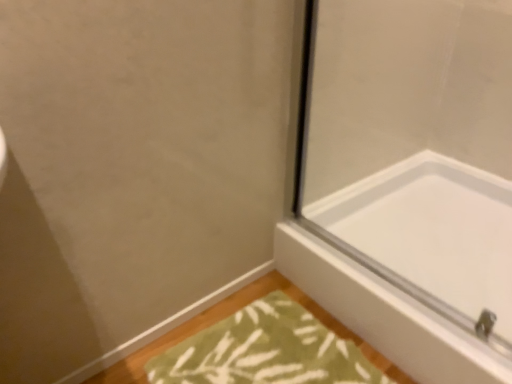
Question: Can you confirm if green textured bath mat at lower center is wider than white glossy bathtub at lower right?

Choices:
 (A) yes
 (B) no

Answer: (B)

Question: Is green textured bath mat at lower center further to camera compared to white glossy bathtub at lower right?

Choices:
 (A) no
 (B) yes

Answer: (A)

Question: Is green textured bath mat at lower center turned away from white glossy bathtub at lower right?

Choices:
 (A) yes
 (B) no

Answer: (A)

Question: From a real-world perspective, is green textured bath mat at lower center on top of white glossy bathtub at lower right?

Choices:
 (A) no
 (B) yes

Answer: (A)

Question: Would you say green textured bath mat at lower center is outside white glossy bathtub at lower right?

Choices:
 (A) yes
 (B) no

Answer: (A)

Question: From a real-world perspective, is green textured bath mat at lower center positioned under white glossy bathtub at lower right based on gravity?

Choices:
 (A) yes
 (B) no

Answer: (A)

Question: Is the position of white glossy bathtub at lower right less distant than that of green textured bath mat at lower center?

Choices:
 (A) yes
 (B) no

Answer: (B)

Question: Can you confirm if white glossy bathtub at lower right is positioned to the left of green textured bath mat at lower center?

Choices:
 (A) yes
 (B) no

Answer: (B)

Question: From a real-world perspective, is white glossy bathtub at lower right on green textured bath mat at lower center?

Choices:
 (A) yes
 (B) no

Answer: (A)

Question: Can you confirm if white glossy bathtub at lower right is shorter than green textured bath mat at lower center?

Choices:
 (A) yes
 (B) no

Answer: (B)

Question: Is white glossy bathtub at lower right facing away from green textured bath mat at lower center?

Choices:
 (A) no
 (B) yes

Answer: (A)

Question: From the image's perspective, is white glossy bathtub at lower right below green textured bath mat at lower center?

Choices:
 (A) no
 (B) yes

Answer: (A)

Question: Considering the positions of green textured bath mat at lower center and white glossy bathtub at lower right in the image, is green textured bath mat at lower center bigger or smaller than white glossy bathtub at lower right?

Choices:
 (A) small
 (B) big

Answer: (A)